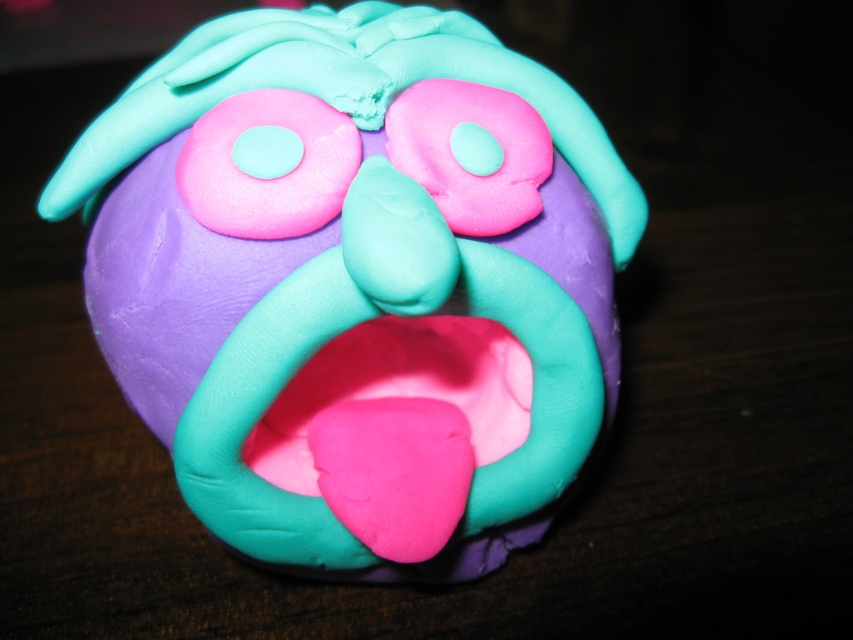
Is matte clay face at center positioned behind pink matte donut at upper center?

No, it is in front of pink matte donut at upper center.

Locate an element on the screen. The image size is (853, 640). matte clay face at center is located at coordinates (357, 280).

The height and width of the screenshot is (640, 853). Find the location of `matte clay face at center`. matte clay face at center is located at coordinates (357, 280).